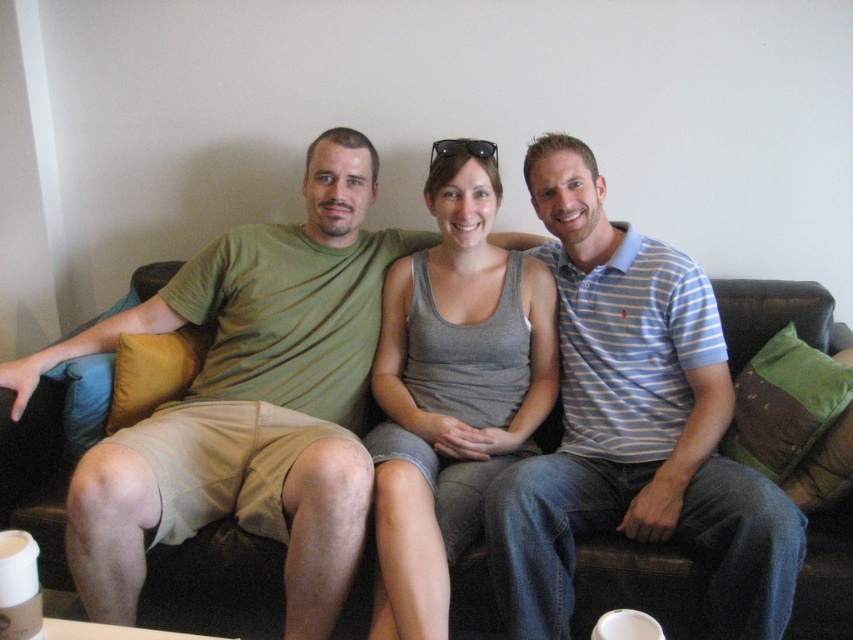
Question: Is gray tank top at center thinner than brown leather couch at center?

Choices:
 (A) yes
 (B) no

Answer: (A)

Question: Which object is closer to the camera taking this photo?

Choices:
 (A) blue striped polo shirt at center
 (B) gray tank top at center

Answer: (B)

Question: Which point is closer to the camera?

Choices:
 (A) gray tank top at center
 (B) brown leather couch at center
 (C) blue striped polo shirt at center

Answer: (A)

Question: Does blue striped polo shirt at center have a larger size compared to brown leather couch at center?

Choices:
 (A) yes
 (B) no

Answer: (B)

Question: Is blue striped polo shirt at center below gray tank top at center?

Choices:
 (A) no
 (B) yes

Answer: (A)

Question: Which object is the closest to the brown leather couch at center?

Choices:
 (A) blue striped polo shirt at center
 (B) gray tank top at center

Answer: (A)